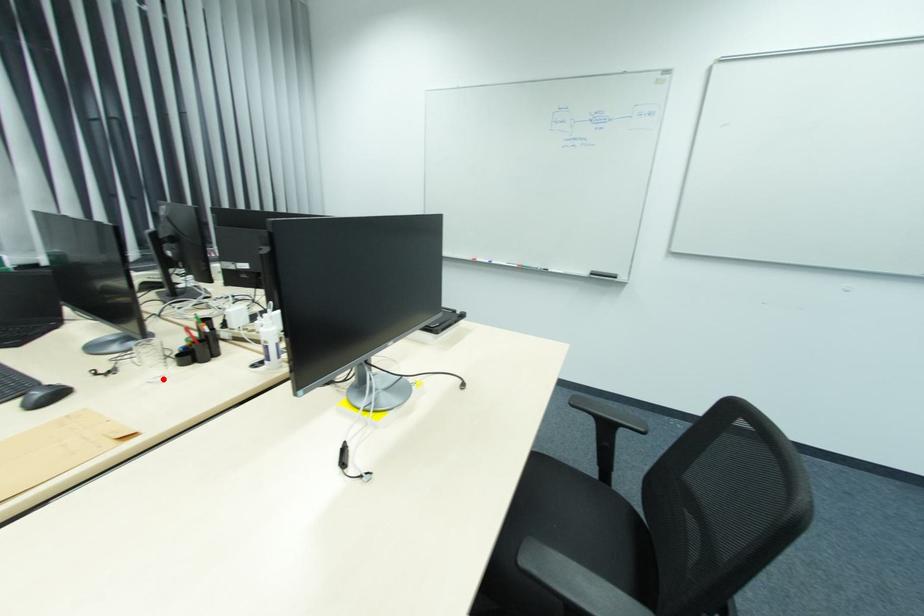
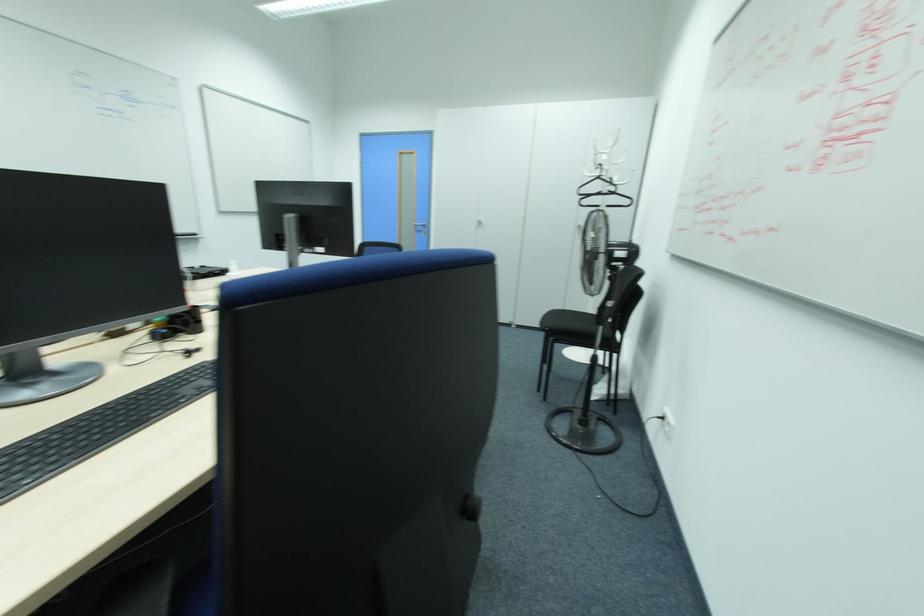
Question: I am providing you with two images of the same scene from different viewpoints. A red point is marked on the first image. Can you still see the location of the red point in image 2?

Choices:
 (A) Yes
 (B) No

Answer: (B)